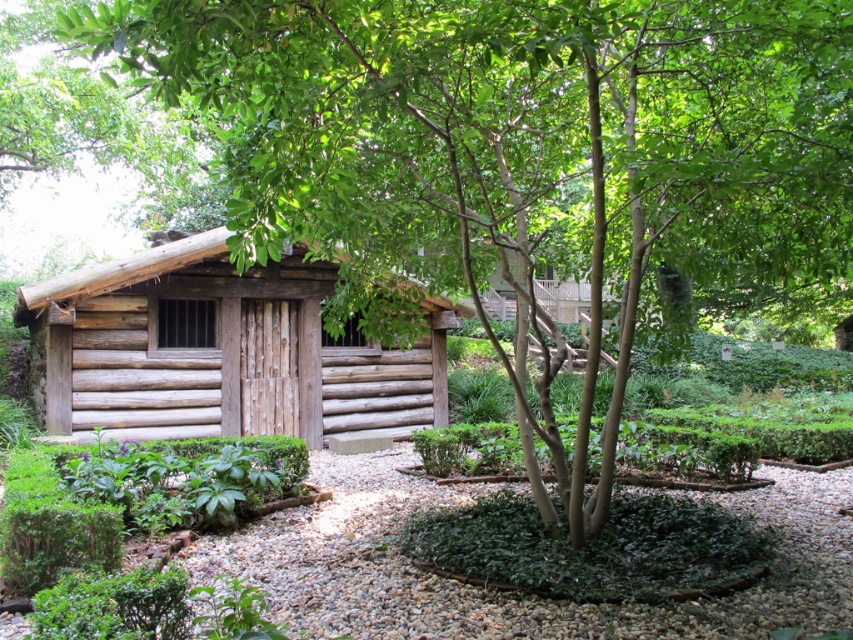
Based on the scene description, where is the natural wood log cabin at center located in terms of its 2D coordinates?

The natural wood log cabin at center is located at coordinates 0.548 in the x axis and 0.259 in the y axis.

You are planning to install a solar panel on the highest point of the natural wood log cabin at center. Since the white gravel at center is lower, will the solar panel be visible from the ground level?

The natural wood log cabin at center is taller than the white gravel at center, so the solar panel installed on its highest point will likely be visible from the ground level.